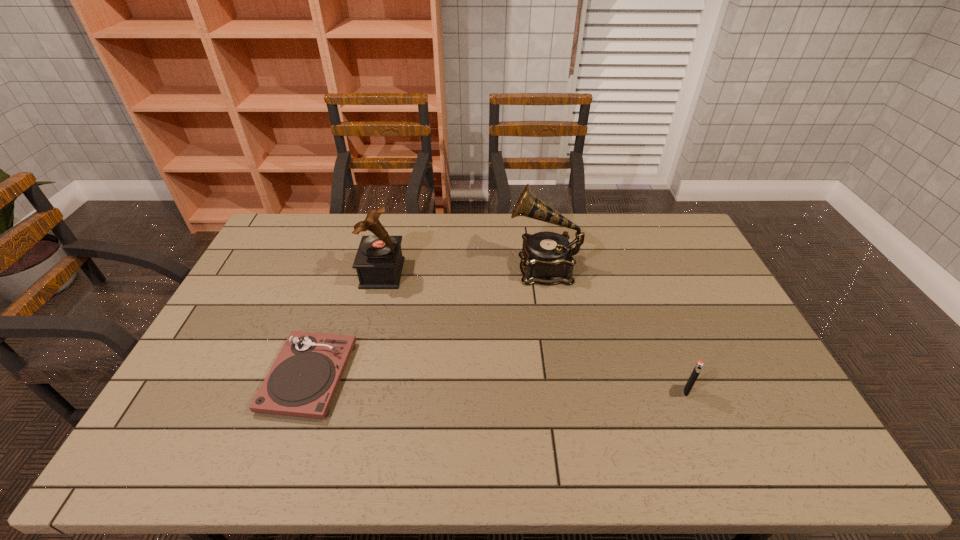
The height and width of the screenshot is (540, 960). Find the location of `vacant space that satisfies the following two spatial constraints: 1. on the back side of the third tallest object; 2. on the horn of the rightmost phonograph_record`. vacant space that satisfies the following two spatial constraints: 1. on the back side of the third tallest object; 2. on the horn of the rightmost phonograph_record is located at coordinates (636, 267).